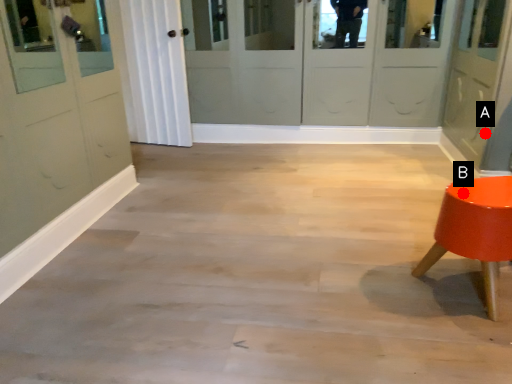
Question: Two points are circled on the image, labeled by A and B beside each circle. Which point appears closest to the camera in this image?

Choices:
 (A) A is closer
 (B) B is closer

Answer: (B)